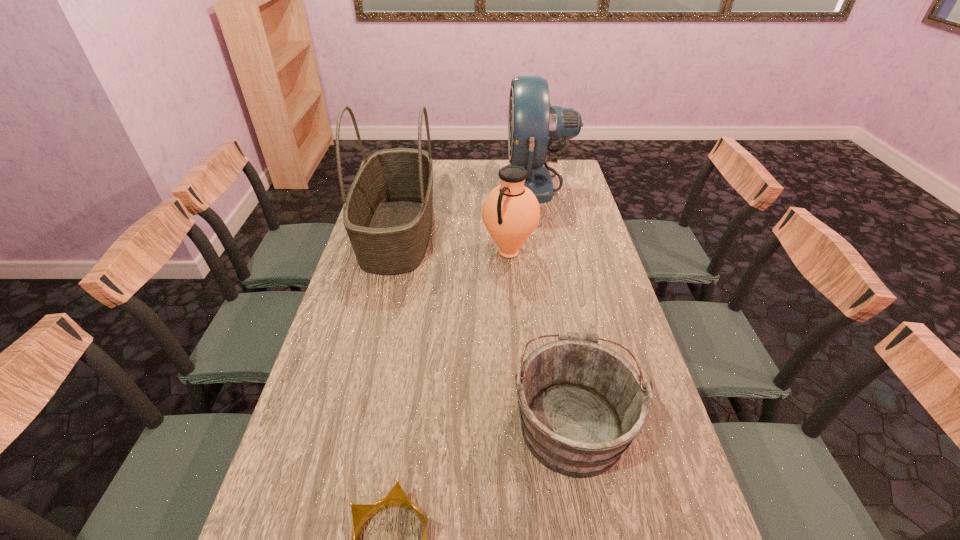
This screenshot has width=960, height=540. I want to click on empty space between the fan and the second shortest object, so click(554, 303).

Locate an element on the screen. This screenshot has width=960, height=540. vacant area between the fan and the basket is located at coordinates (468, 207).

Locate an element on the screen. This screenshot has height=540, width=960. free space between the fourth tallest object and the fan is located at coordinates (554, 303).

The width and height of the screenshot is (960, 540). I want to click on free area in between the basket and the third shortest object, so click(453, 241).

Identify the location of vacant area that lies between the second shortest object and the basket. (485, 327).

Where is `free space between the fan and the basket`? free space between the fan and the basket is located at coordinates (468, 207).

You are a GUI agent. You are given a task and a screenshot of the screen. Output one action in this format:
    pyautogui.click(x=<x>, y=<y>)
    Task: Click on the third closest object to the pitcher
    
    Given the screenshot: What is the action you would take?
    pyautogui.click(x=581, y=404)

Select which object appears as the third closest to the nearest object. Please provide its 2D coordinates. Your answer should be formatted as a tuple, i.e. [(x, y)], where the tuple contains the x and y coordinates of a point satisfying the conditions above.

[(510, 212)]

Where is `vacant space that satisfies the following two spatial constraints: 1. in front of the fan to blow air; 2. on the front side of the fourth tallest object`? This screenshot has height=540, width=960. vacant space that satisfies the following two spatial constraints: 1. in front of the fan to blow air; 2. on the front side of the fourth tallest object is located at coordinates (583, 422).

The width and height of the screenshot is (960, 540). In order to click on vacant region that satisfies the following two spatial constraints: 1. in front of the fan to blow air; 2. on the front side of the wine bucket in this screenshot , I will do coord(583,422).